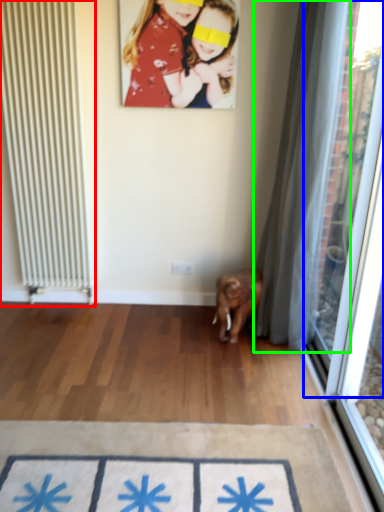
Question: Based on their relative distances, which object is farther from radiator (highlighted by a red box)? Choose from window screen (highlighted by a blue box) and curtain (highlighted by a green box).

Choices:
 (A) window screen
 (B) curtain

Answer: (A)